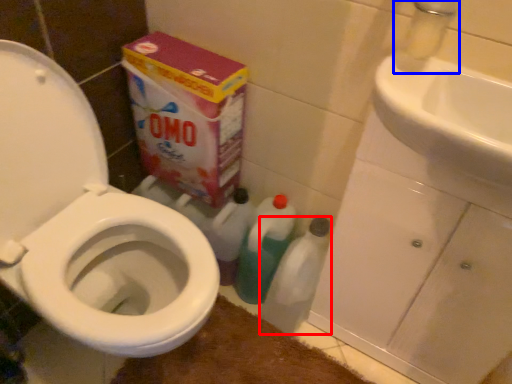
Question: Among these objects, which one is nearest to the camera, cleaning product (highlighted by a red box) or faucet (highlighted by a blue box)?

Choices:
 (A) cleaning product
 (B) faucet

Answer: (B)